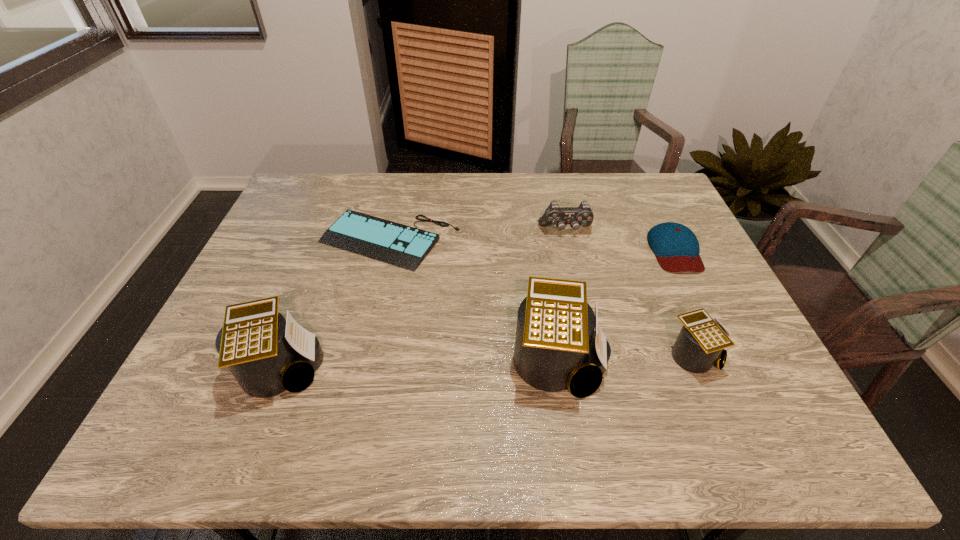
In the image, there is a desktop. Where is `free region at the left edge`? free region at the left edge is located at coordinates (323, 215).

Image resolution: width=960 pixels, height=540 pixels. What are the coordinates of `vacant space at the right edge` in the screenshot? It's located at (666, 301).

Locate an element on the screen. Image resolution: width=960 pixels, height=540 pixels. vacant space at the far right corner of the desktop is located at coordinates tap(661, 212).

The width and height of the screenshot is (960, 540). What are the coordinates of `blank region between the second calculator from left to right and the fifth tallest object` in the screenshot? It's located at (617, 306).

The image size is (960, 540). In order to click on vacant space that is in between the second shortest object and the control in this screenshot , I will do `click(620, 241)`.

You are a GUI agent. You are given a task and a screenshot of the screen. Output one action in this format:
    pyautogui.click(x=<x>, y=<y>)
    Task: Click on the free space between the control and the second tallest calculator
    Image resolution: width=960 pixels, height=540 pixels.
    Given the screenshot: What is the action you would take?
    pyautogui.click(x=423, y=300)

Find the location of a particular element. free area in between the baseball cap and the computer keyboard is located at coordinates (533, 246).

You are a GUI agent. You are given a task and a screenshot of the screen. Output one action in this format:
    pyautogui.click(x=<x>, y=<y>)
    Task: Click on the vacant point located between the computer keyboard and the second tallest calculator
    
    Given the screenshot: What is the action you would take?
    pyautogui.click(x=335, y=305)

This screenshot has height=540, width=960. What are the coordinates of `free space that is in between the rightmost calculator and the control` in the screenshot? It's located at (631, 293).

Locate an element on the screen. This screenshot has width=960, height=540. free spot between the computer keyboard and the control is located at coordinates (478, 236).